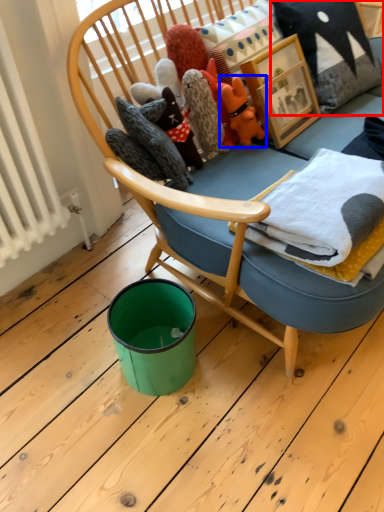
Question: Which object is closer to the camera taking this photo, pillow (highlighted by a red box) or toy (highlighted by a blue box)?

Choices:
 (A) pillow
 (B) toy

Answer: (B)